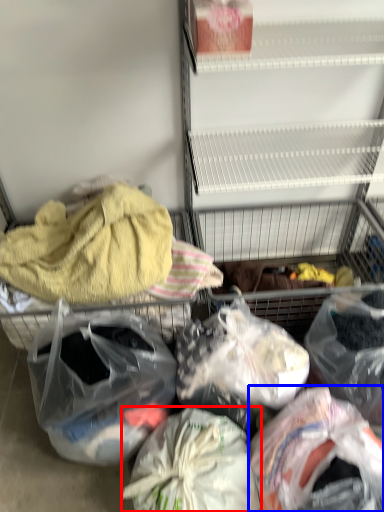
Question: Which of the following is the closest to the observer, plastic bag (highlighted by a red box) or plastic bag (highlighted by a blue box)?

Choices:
 (A) plastic bag
 (B) plastic bag

Answer: (B)